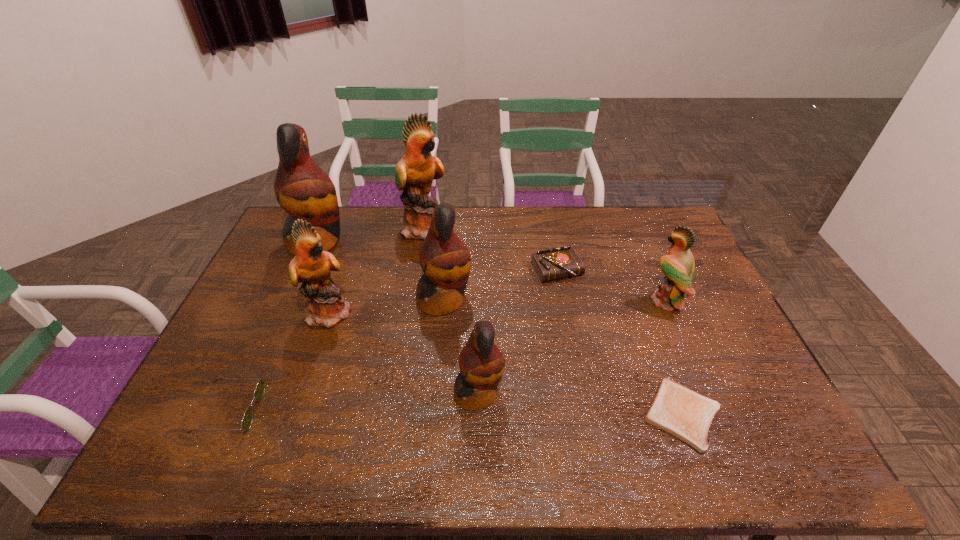
What are the coordinates of `object at the far left corner` in the screenshot? It's located at click(x=302, y=189).

Identify the location of object present at the near left corner. (247, 419).

I want to click on object present at the near right corner, so click(676, 409).

In the image, there is a desktop. Identify the location of free space at the far edge. This screenshot has width=960, height=540. (480, 213).

What are the coordinates of `vacant region at the near edge of the desktop` in the screenshot? It's located at (319, 436).

In the image, there is a desktop. Where is `free space at the left edge`? This screenshot has height=540, width=960. free space at the left edge is located at coordinates (228, 332).

At what (x,y) coordinates should I click in order to perform the action: click on free space at the right edge of the desktop. Please return your answer as a coordinate pair (x, y). The height and width of the screenshot is (540, 960). Looking at the image, I should click on [741, 356].

Identify the location of free space at the far right corner of the desktop. The height and width of the screenshot is (540, 960). (662, 212).

The height and width of the screenshot is (540, 960). Identify the location of free spot between the second smallest red parrot and the rightmost green parrot. (555, 301).

This screenshot has height=540, width=960. Find the location of `empty location between the diary and the second nearest red parrot`. empty location between the diary and the second nearest red parrot is located at coordinates (500, 285).